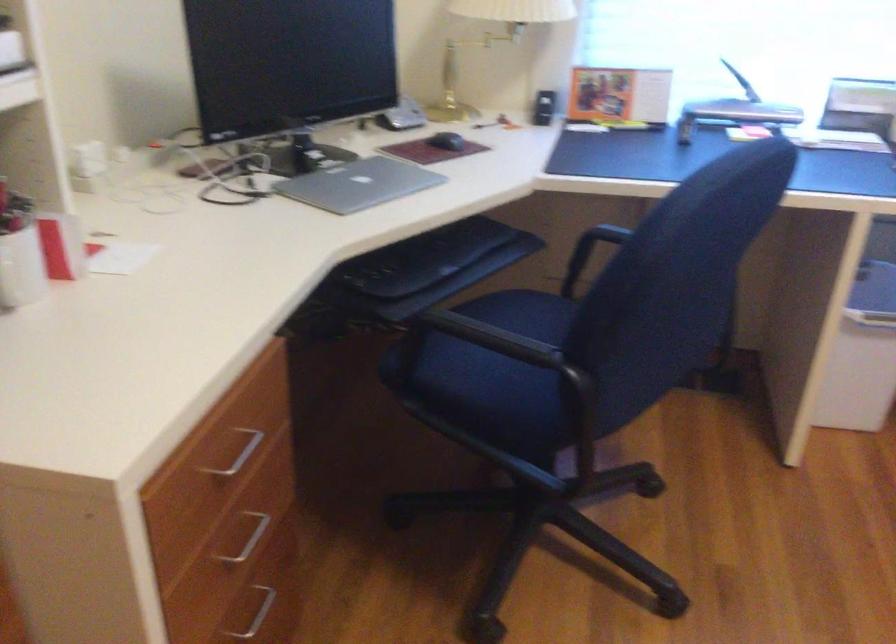
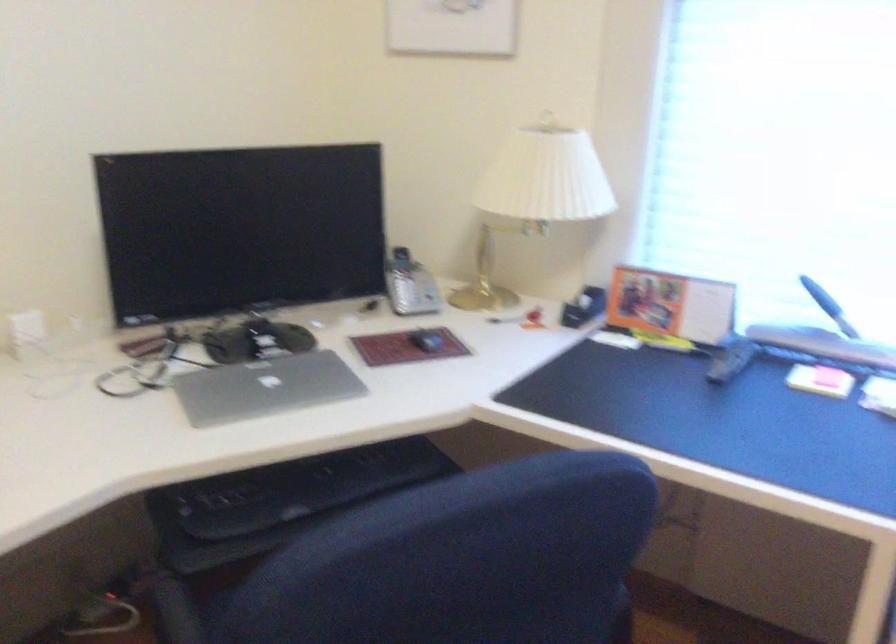
In the second image, find the point that corresponds to [432,257] in the first image.

(302, 488)